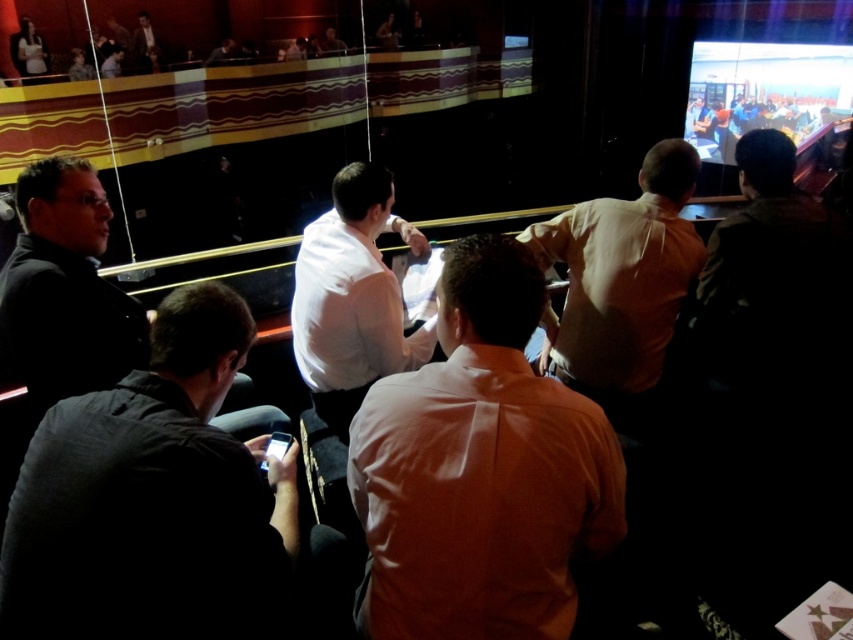
Question: Does white smooth shirt at center appear over matte white shirt at upper left?

Choices:
 (A) yes
 (B) no

Answer: (B)

Question: Which of the following is the farthest from the observer?

Choices:
 (A) dark gray suit at upper center
 (B) light brown shirt at center
 (C) white smooth shirt at center

Answer: (A)

Question: Does matte white shirt at upper left appear under dark gray suit at upper center?

Choices:
 (A) no
 (B) yes

Answer: (B)

Question: Which point is farther to the camera?

Choices:
 (A) matte white shirt at upper left
 (B) dark gray shirt at left
 (C) white smooth shirt at center

Answer: (A)

Question: Is orange cotton shirt at center wider than matte black jacket at upper left?

Choices:
 (A) yes
 (B) no

Answer: (B)

Question: Which point is closer to the camera?

Choices:
 (A) (79, 593)
 (B) (543, 324)
 (C) (120, 374)

Answer: (A)